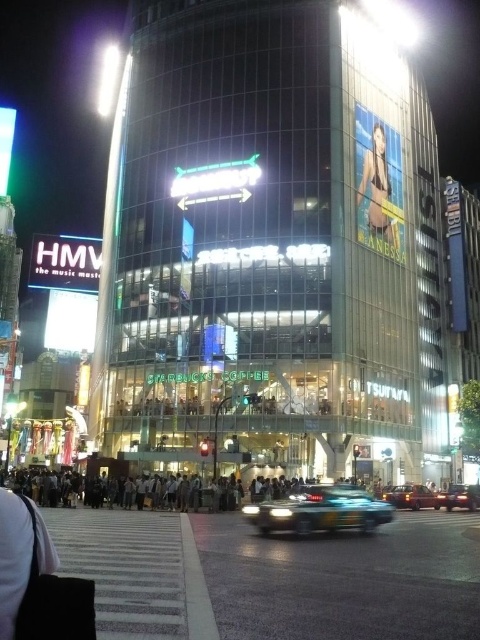
Who is positioned more to the left, metallic blue car at center or matte red sedan at center?

From the viewer's perspective, metallic blue car at center appears more on the left side.

Who is more distant from viewer, (x=335, y=525) or (x=422, y=496)?

Positioned behind is point (x=422, y=496).

The image size is (480, 640). Identify the location of metallic blue car at center. (320, 509).

Which is in front, point (361, 493) or point (462, 502)?

Point (361, 493) is more forward.

You are a GUI agent. You are given a task and a screenshot of the screen. Output one action in this format:
    pyautogui.click(x=<x>, y=<y>)
    Task: Click on the metallic blue car at center
    
    Given the screenshot: What is the action you would take?
    pyautogui.click(x=320, y=509)

Is point (365, 528) less distant than point (462, 496)?

Yes, point (365, 528) is in front of point (462, 496).

Image resolution: width=480 pixels, height=640 pixels. Find the location of `metallic blue car at center`. metallic blue car at center is located at coordinates (320, 509).

Between clear plastic billboard at upper center and matte red sedan at center, which one has less height?

With less height is matte red sedan at center.

Is point (385, 196) positioned in front of point (391, 499)?

That is False.

Between point (376, 212) and point (414, 492), which one is positioned behind?

Positioned behind is point (376, 212).

Locate an element on the screen. The height and width of the screenshot is (640, 480). clear plastic billboard at upper center is located at coordinates (377, 189).